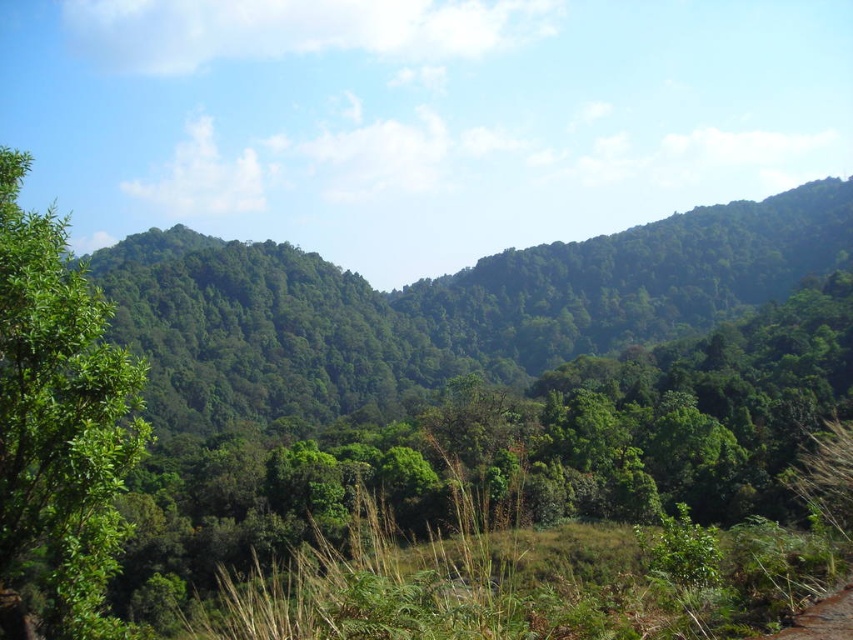
Question: Which point is closer to the camera?

Choices:
 (A) green leafy forest at center
 (B) green leafy tree at left

Answer: (B)

Question: Does green leafy forest at center appear on the left side of green leafy tree at left?

Choices:
 (A) yes
 (B) no

Answer: (B)

Question: Is green leafy forest at center wider than green leafy tree at left?

Choices:
 (A) yes
 (B) no

Answer: (A)

Question: Among these objects, which one is farthest from the camera?

Choices:
 (A) green leafy tree at left
 (B) green leafy forest at center

Answer: (B)

Question: Is green leafy forest at center to the left of green leafy tree at left from the viewer's perspective?

Choices:
 (A) yes
 (B) no

Answer: (B)

Question: Which point is farther from the camera taking this photo?

Choices:
 (A) [33, 216]
 (B) [769, 259]

Answer: (B)